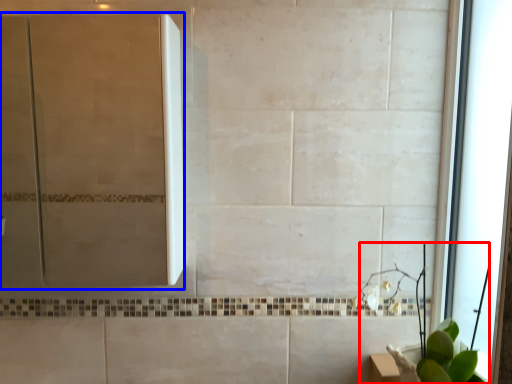
Question: Among these objects, which one is farthest to the camera, plant (highlighted by a red box) or screen door (highlighted by a blue box)?

Choices:
 (A) plant
 (B) screen door

Answer: (B)